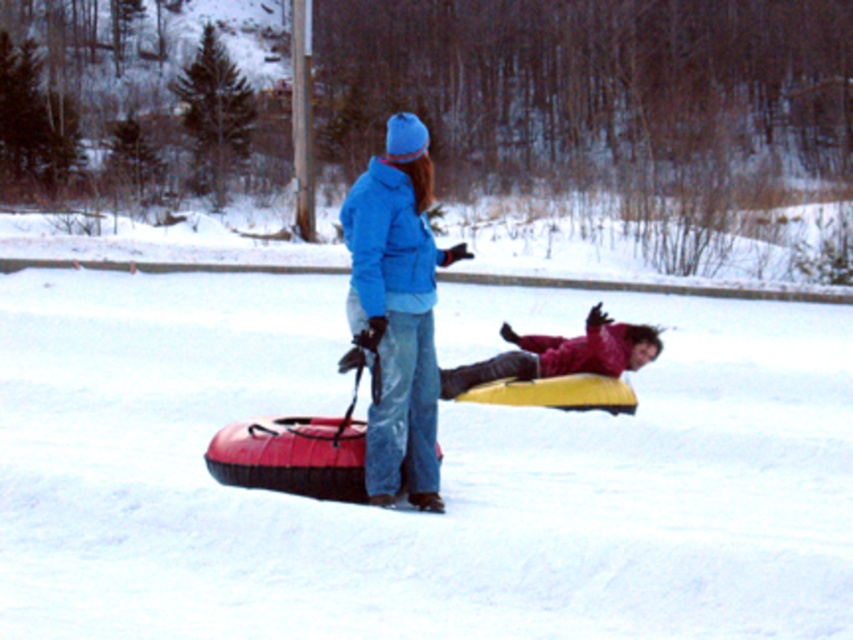
Where is `matte blue jacket at center`? matte blue jacket at center is located at coordinates (396, 312).

Does point (380, 404) come in front of point (602, 340)?

That is True.

In order to click on matte blue jacket at center in this screenshot , I will do [396, 312].

Locate an element on the screen. This screenshot has height=640, width=853. matte blue jacket at center is located at coordinates (396, 312).

Does point (102, 449) lie behind point (601, 342)?

No, it is in front of (601, 342).

Who is more forward, (370, 513) or (508, 372)?

Positioned in front is point (370, 513).

The height and width of the screenshot is (640, 853). I want to click on white matte snow at center, so click(440, 472).

Image resolution: width=853 pixels, height=640 pixels. In order to click on white matte snow at center in this screenshot , I will do `click(440, 472)`.

Describe the element at coordinates (440, 472) in the screenshot. I see `white matte snow at center` at that location.

Does white matte snow at center appear over matte blue jacket at center?

Actually, white matte snow at center is below matte blue jacket at center.

From the picture: Who is more forward, (x=805, y=394) or (x=422, y=300)?

Point (x=422, y=300)

Locate an element on the screen. The height and width of the screenshot is (640, 853). white matte snow at center is located at coordinates (440, 472).